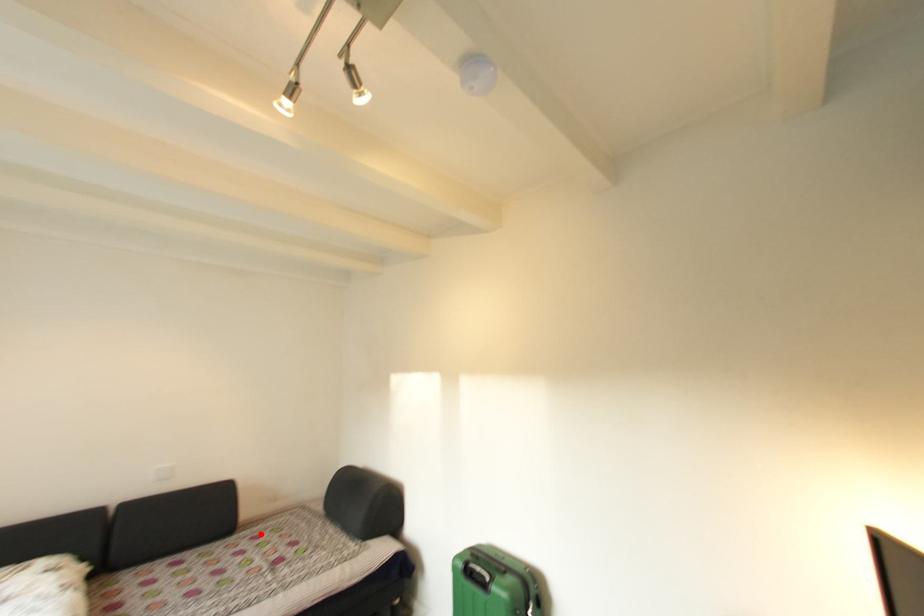
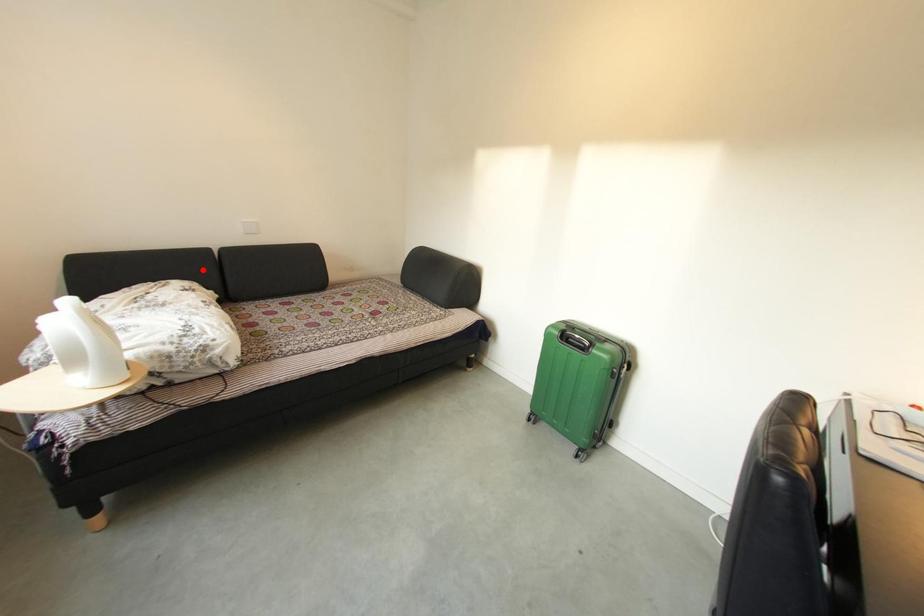
I am providing you with two images of the same scene from different viewpoints. A red point is marked on the first image and another point is marked on the second image. Is the marked point in image1 the same physical position as the marked point in image2?

No